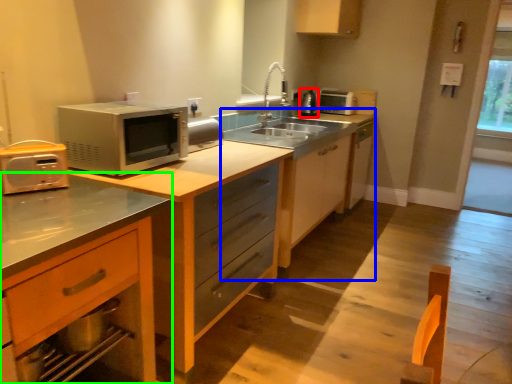
Question: Estimate the real-world distances between objects in this image. Which object is closer to appliance (highlighted by a red box), dresser (highlighted by a blue box) or cabinetry (highlighted by a green box)?

Choices:
 (A) dresser
 (B) cabinetry

Answer: (A)